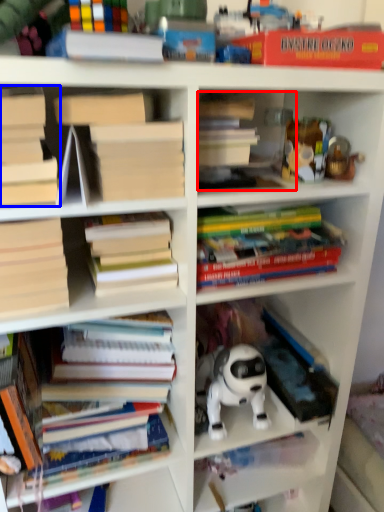
Question: Which of the following is the farthest to the observer, book (highlighted by a red box) or book (highlighted by a blue box)?

Choices:
 (A) book
 (B) book

Answer: (A)